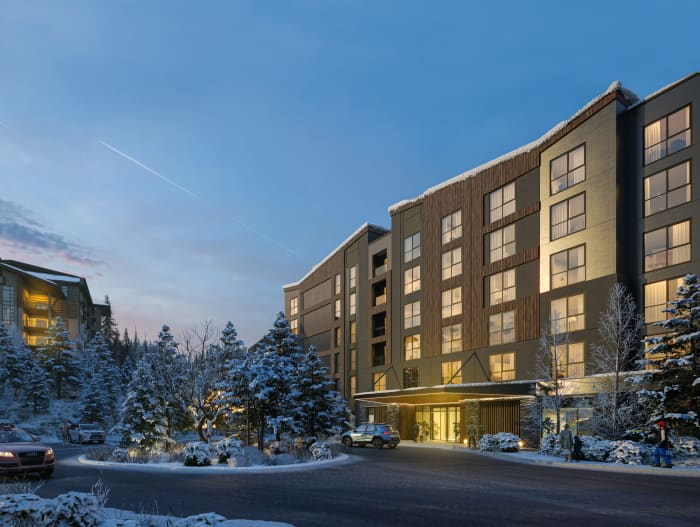
What are the coordinates of `doors` in the screenshot? It's located at (438, 421).